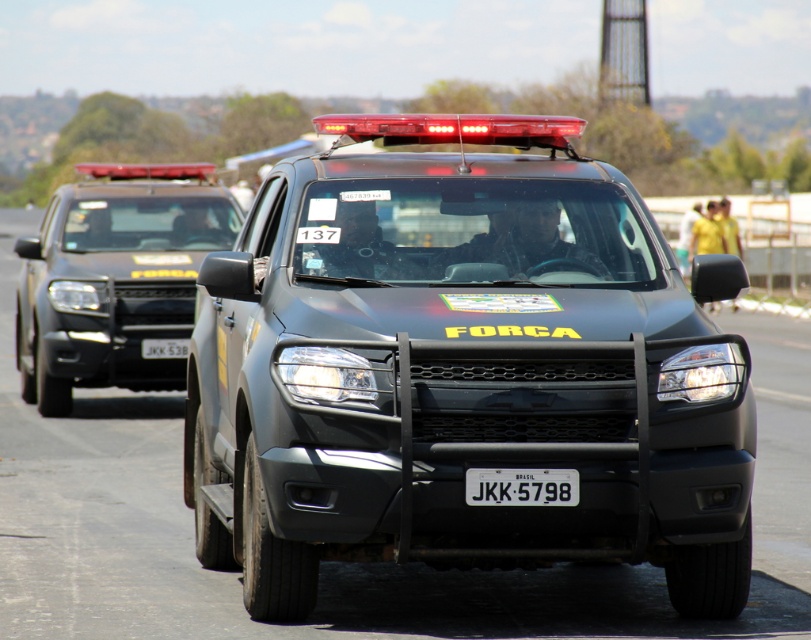
You are a photographer trying to capture both the matte black suv at left and the black plastic license plate at center in a single shot. Since the license plate is closer to the camera, will the suv still be visible in the frame if you focus on the license plate?

The matte black suv at left is taller than the black plastic license plate at center, so even if you focus on the license plate, the suv should still be visible in the frame because its height extends beyond the license plate.

Based on the photo, you are a traffic officer observing the scene. You notice the matte black truck at center and the white plastic license plate at center. Which object is positioned to the left?

The white plastic license plate at center is positioned to the left of the matte black truck at center.